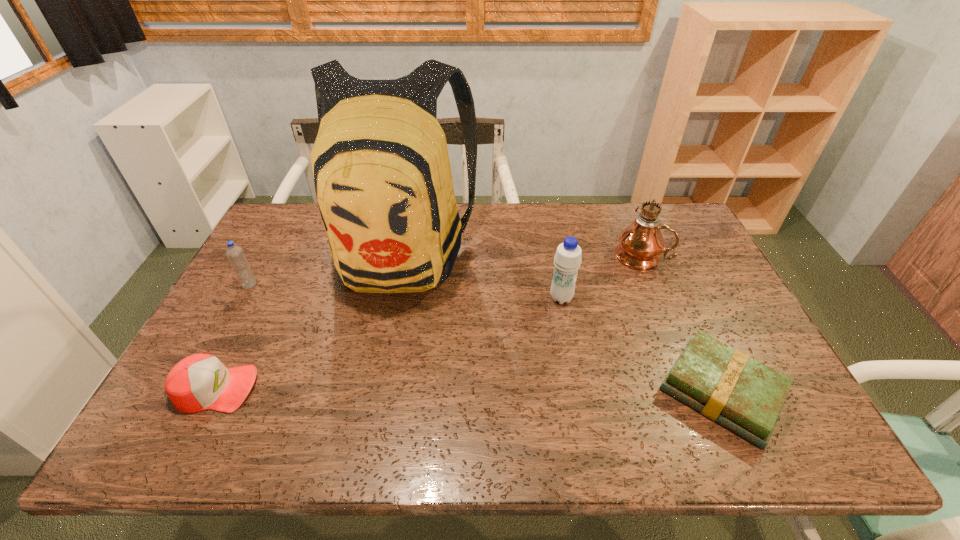
The image size is (960, 540). What are the coordinates of `vacant area that lies between the oil lamp and the baseball cap` in the screenshot? It's located at (428, 322).

The image size is (960, 540). Find the location of `unoccupied position between the second tallest object and the fourth object from right to left`. unoccupied position between the second tallest object and the fourth object from right to left is located at coordinates (521, 254).

Where is `empty location between the right water bottle and the book`? The width and height of the screenshot is (960, 540). empty location between the right water bottle and the book is located at coordinates (641, 345).

What are the coordinates of `free space between the fourth object from right to left and the second shortest object` in the screenshot? It's located at (309, 320).

Where is `vacant space that's between the shortest object and the right water bottle`? This screenshot has height=540, width=960. vacant space that's between the shortest object and the right water bottle is located at coordinates (641, 345).

Locate an element on the screen. blank region between the shorter water bottle and the book is located at coordinates (486, 339).

You are a GUI agent. You are given a task and a screenshot of the screen. Output one action in this format:
    pyautogui.click(x=<x>, y=<y>)
    Task: Click on the empty space between the book and the left water bottle
    The width and height of the screenshot is (960, 540).
    Given the screenshot: What is the action you would take?
    pyautogui.click(x=486, y=339)

You are a GUI agent. You are given a task and a screenshot of the screen. Output one action in this format:
    pyautogui.click(x=<x>, y=<y>)
    Task: Click on the fourth closest object to the second shortest object
    This screenshot has height=540, width=960.
    Given the screenshot: What is the action you would take?
    pyautogui.click(x=725, y=385)

Identify the location of object that stands as the second closest to the third shortest object. This screenshot has width=960, height=540. (198, 382).

You are a GUI agent. You are given a task and a screenshot of the screen. Output one action in this format:
    pyautogui.click(x=<x>, y=<y>)
    Task: Click on the vacant space that satisfies the following two spatial constraints: 1. on the front-facing side of the third object from left to right; 2. on the right side of the book
    
    Given the screenshot: What is the action you would take?
    pyautogui.click(x=373, y=392)